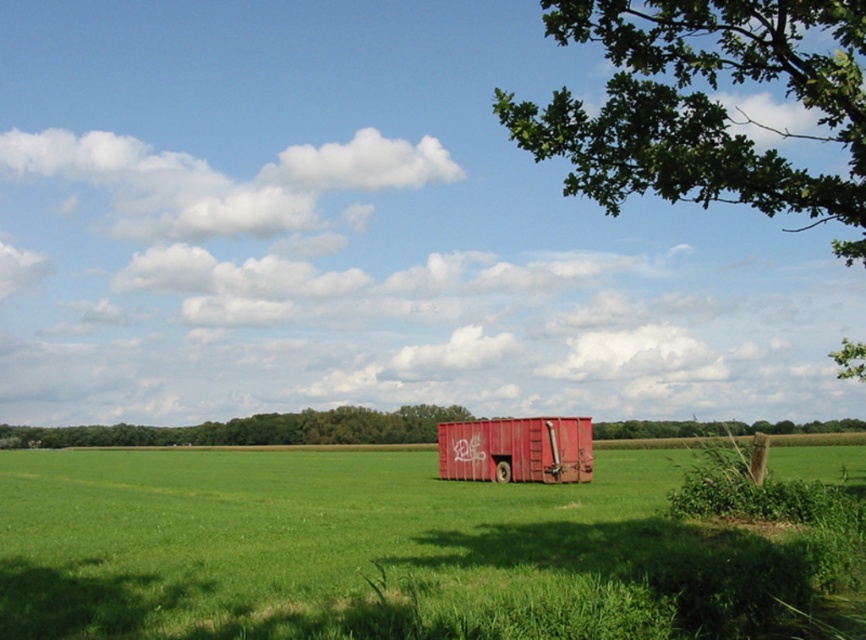
Looking at this image, you are standing in the middle of the green grassy field at center and want to walk towards the green leafy tree at upper right. Which direction should you head?

Since the green grassy field at center is closer to the viewer than the green leafy tree at upper right, you should head towards the upper right direction to reach the green leafy tree at upper right.

Based on the photo, you are a farmer who needs to mow the green grassy field at center and the rusty metal train car at center. Which area requires mowing first based on their current height?

The green grassy field at center is much taller than the rusty metal train car at center, so the farmer should mow the green grassy field at center first.